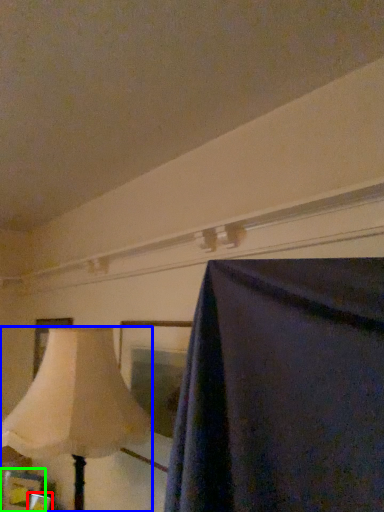
Question: Considering the real-world distances, which object is closest to picture frame (highlighted by a red box)? lamp (highlighted by a blue box) or picture frame (highlighted by a green box).

Choices:
 (A) lamp
 (B) picture frame

Answer: (B)